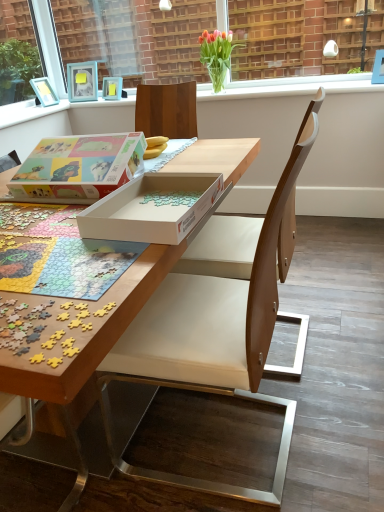
Question: Is clear glass window frame at upper center to the left or to the right of matte blue picture frame at upper left in the image?

Choices:
 (A) right
 (B) left

Answer: (A)

Question: From a real-world perspective, is clear glass window frame at upper center above or below matte blue picture frame at upper left?

Choices:
 (A) below
 (B) above

Answer: (B)

Question: Which is nearer to the clear glass window frame at upper center?

Choices:
 (A) vivid tulips in glass vase at upper center
 (B) pastel matte puzzle box at center
 (C) wooden chair at center
 (D) wooden puzzle pieces at center
 (E) matte blue picture frame at upper left

Answer: (A)

Question: Which is farther from the white cardboard box at center?

Choices:
 (A) wooden puzzle pieces at center
 (B) matte blue picture frame at upper left
 (C) clear glass window frame at upper center
 (D) wooden chair at center
 (E) vivid tulips in glass vase at upper center

Answer: (C)